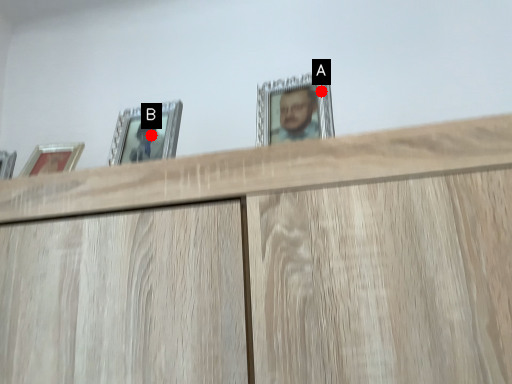
Question: Two points are circled on the image, labeled by A and B beside each circle. Which point is farther from the camera taking this photo?

Choices:
 (A) A is further
 (B) B is further

Answer: (B)